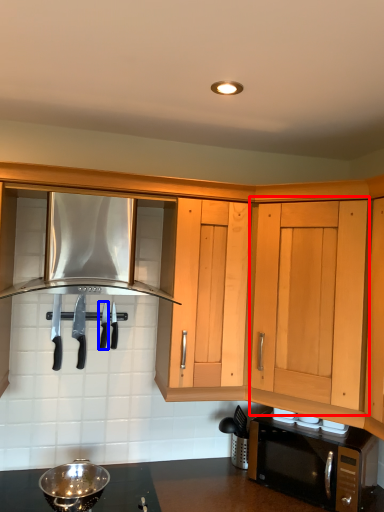
Question: Which of the following is the closest to the observer, cabinetry (highlighted by a red box) or silverware (highlighted by a blue box)?

Choices:
 (A) cabinetry
 (B) silverware

Answer: (A)